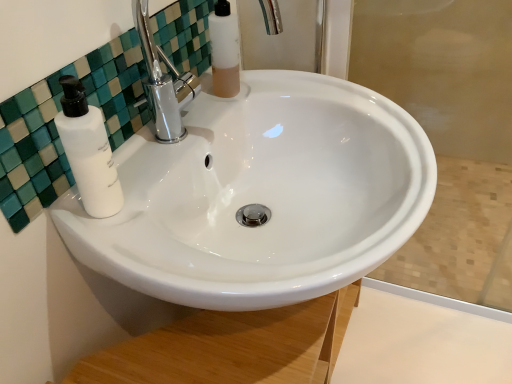
Question: Is white matte soap dispenser at left smaller than white glossy sink at center?

Choices:
 (A) no
 (B) yes

Answer: (B)

Question: Is white matte soap dispenser at left far away from white glossy sink at center?

Choices:
 (A) no
 (B) yes

Answer: (A)

Question: From the image's perspective, is white matte soap dispenser at left on top of white glossy sink at center?

Choices:
 (A) yes
 (B) no

Answer: (A)

Question: Can you confirm if white matte soap dispenser at left is taller than white glossy sink at center?

Choices:
 (A) no
 (B) yes

Answer: (A)

Question: Could you tell me if white matte soap dispenser at left is turned towards white glossy sink at center?

Choices:
 (A) yes
 (B) no

Answer: (B)

Question: Is white matte soap dispenser at left not inside white glossy sink at center?

Choices:
 (A) no
 (B) yes

Answer: (B)

Question: From a real-world perspective, does translucent plastic mouthwash at upper center sit lower than white matte soap dispenser at left?

Choices:
 (A) yes
 (B) no

Answer: (A)

Question: Is translucent plastic mouthwash at upper center not near white matte soap dispenser at left?

Choices:
 (A) yes
 (B) no

Answer: (B)

Question: Is translucent plastic mouthwash at upper center smaller than white matte soap dispenser at left?

Choices:
 (A) yes
 (B) no

Answer: (B)

Question: Considering the relative sizes of translucent plastic mouthwash at upper center and white matte soap dispenser at left in the image provided, is translucent plastic mouthwash at upper center thinner than white matte soap dispenser at left?

Choices:
 (A) no
 (B) yes

Answer: (A)

Question: Does translucent plastic mouthwash at upper center lie behind white matte soap dispenser at left?

Choices:
 (A) yes
 (B) no

Answer: (A)

Question: From the image's perspective, is translucent plastic mouthwash at upper center on top of white matte soap dispenser at left?

Choices:
 (A) yes
 (B) no

Answer: (A)

Question: From a real-world perspective, is white glossy sink at center on white matte soap dispenser at left?

Choices:
 (A) no
 (B) yes

Answer: (A)